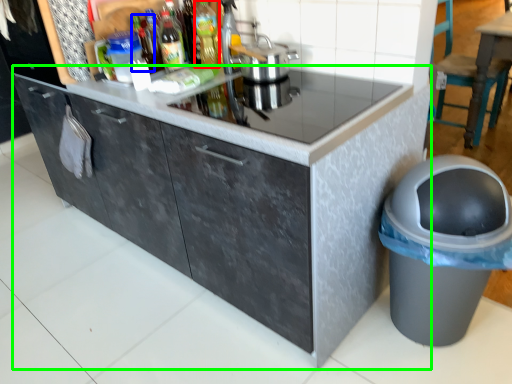
Question: Which object is the farthest from bottle (highlighted by a red box)? Choose among these: bottle (highlighted by a blue box) or cabinetry (highlighted by a green box).

Choices:
 (A) bottle
 (B) cabinetry

Answer: (B)